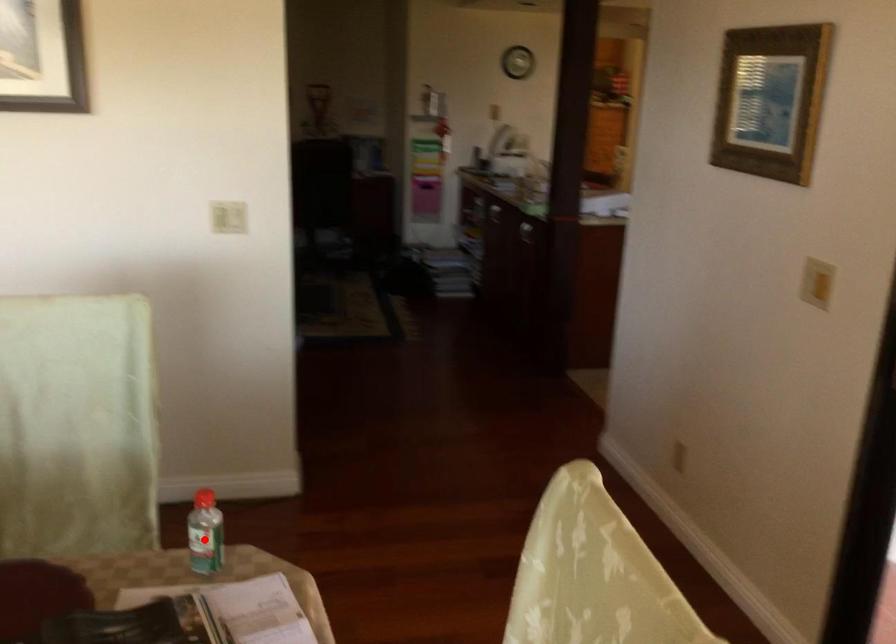
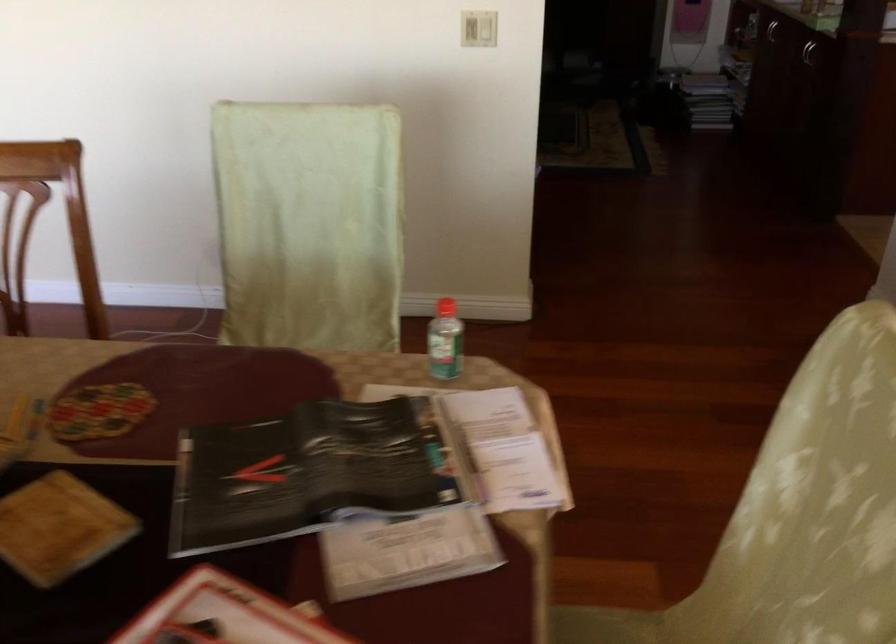
The point at the highlighted location is marked in the first image. Where is the corresponding point in the second image?

(444, 341)